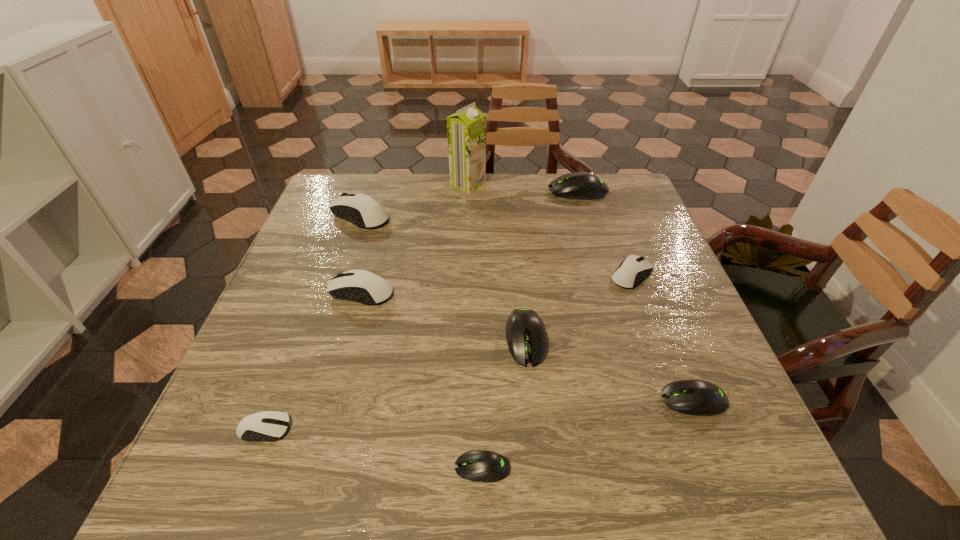
Identify the location of green soya milk. This screenshot has height=540, width=960. (466, 129).

In order to click on soya milk in this screenshot , I will do `click(466, 129)`.

Identify the location of the biggest white mouse. (360, 209).

Find the location of `the farthest white mouse`. the farthest white mouse is located at coordinates (360, 209).

Image resolution: width=960 pixels, height=540 pixels. In order to click on the biggest gray computer mouse in this screenshot , I will do `click(579, 185)`.

Identify the location of the farthest computer mouse. This screenshot has height=540, width=960. (579, 185).

Image resolution: width=960 pixels, height=540 pixels. Identify the location of the third smallest white mouse. (362, 286).

In order to click on the fourth computer mouse from right to left in this screenshot , I will do `click(525, 337)`.

You are a GUI agent. You are given a task and a screenshot of the screen. Output one action in this format:
    pyautogui.click(x=<x>, y=<y>)
    Task: Click on the third smallest gray computer mouse
    This screenshot has width=960, height=540.
    Given the screenshot: What is the action you would take?
    pyautogui.click(x=525, y=337)

This screenshot has height=540, width=960. In order to click on the rightmost white mouse in this screenshot , I will do `click(634, 269)`.